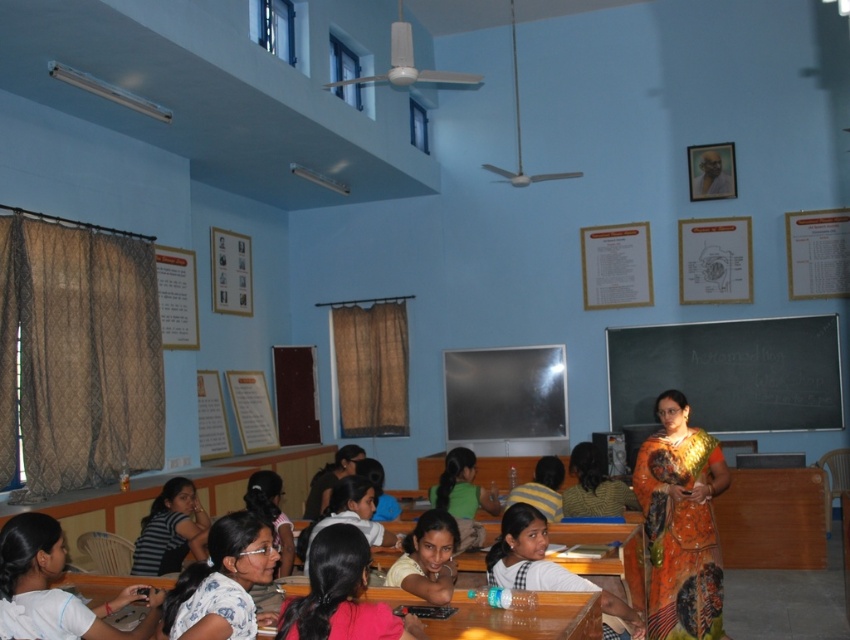
Question: Among these points, which one is farthest from the camera?

Choices:
 (A) (659, 560)
 (B) (408, 602)

Answer: (A)

Question: Is printed silk sari at center positioned at the back of floral fabric shirt at center?

Choices:
 (A) yes
 (B) no

Answer: (A)

Question: Which point is farther to the camera?

Choices:
 (A) (222, 570)
 (B) (1, 532)

Answer: (B)

Question: Which object appears farthest from the camera in this image?

Choices:
 (A) blackboard at center
 (B) light pink fabric shirt at center
 (C) white fabric shirt at lower left

Answer: (A)

Question: Does white fabric shirt at lower left have a lesser width compared to matte white shirt at center?

Choices:
 (A) yes
 (B) no

Answer: (B)

Question: Does blackboard at center have a lesser width compared to wooden table at center?

Choices:
 (A) no
 (B) yes

Answer: (A)